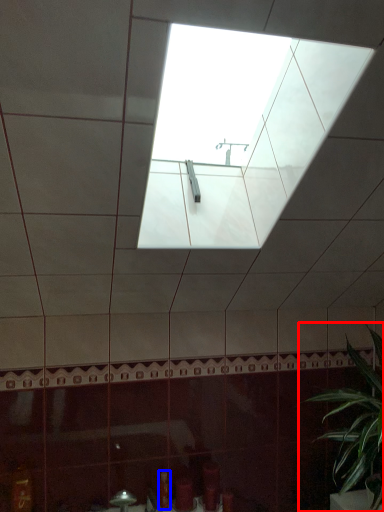
Question: Which object is closer to the camera taking this photo, houseplant (highlighted by a red box) or toiletry (highlighted by a blue box)?

Choices:
 (A) houseplant
 (B) toiletry

Answer: (A)